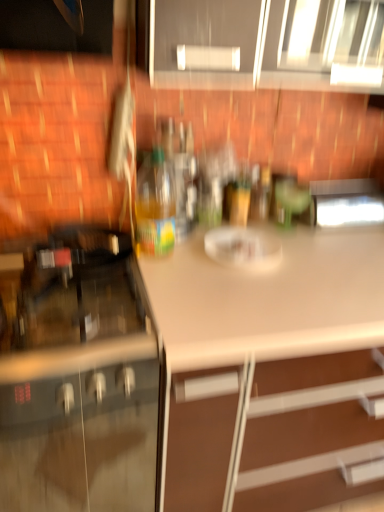
This screenshot has height=512, width=384. Describe the element at coordinates (76, 377) in the screenshot. I see `matte black oven at left, the second cabinetry when ordered from right to left` at that location.

Image resolution: width=384 pixels, height=512 pixels. Describe the element at coordinates (155, 205) in the screenshot. I see `translucent plastic bottle at center` at that location.

Where is `white matte countertop at center`? white matte countertop at center is located at coordinates (271, 372).

Which object is further away from the camera taking this photo, matte black oven at left, acting as the 1th cabinetry starting from the bottom, or matte gray cabinets at upper center, marked as the 2th cabinetry in a bottom-to-top arrangement?

matte gray cabinets at upper center, marked as the 2th cabinetry in a bottom-to-top arrangement, is behind.

Can you confirm if matte black oven at left, the first cabinetry in the left-to-right sequence, is smaller than matte gray cabinets at upper center, positioned as the first cabinetry in top-to-bottom order?

Incorrect, matte black oven at left, the first cabinetry in the left-to-right sequence, is not smaller in size than matte gray cabinets at upper center, positioned as the first cabinetry in top-to-bottom order.

Is matte black oven at left, the second cabinetry when ordered from top to bottom, in contact with matte gray cabinets at upper center, which appears as the 1th cabinetry when viewed from the right?

No, matte black oven at left, the second cabinetry when ordered from top to bottom, is not making contact with matte gray cabinets at upper center, which appears as the 1th cabinetry when viewed from the right.

Considering the relative positions of matte gray cabinets at upper center, marked as the 2th cabinetry in a bottom-to-top arrangement, and matte black oven at left, the second cabinetry when ordered from top to bottom, in the image provided, is matte gray cabinets at upper center, marked as the 2th cabinetry in a bottom-to-top arrangement, to the left of matte black oven at left, the second cabinetry when ordered from top to bottom, from the viewer's perspective?

No, matte gray cabinets at upper center, marked as the 2th cabinetry in a bottom-to-top arrangement, is not to the left of matte black oven at left, the second cabinetry when ordered from top to bottom.

Is matte gray cabinets at upper center, arranged as the second cabinetry when viewed from the left, not within matte black oven at left, the second cabinetry when ordered from right to left?

Indeed, matte gray cabinets at upper center, arranged as the second cabinetry when viewed from the left, is completely outside matte black oven at left, the second cabinetry when ordered from right to left.

Is matte gray cabinets at upper center, which appears as the 1th cabinetry when viewed from the right, positioned in front of matte black oven at left, the first cabinetry in the left-to-right sequence?

No, matte gray cabinets at upper center, which appears as the 1th cabinetry when viewed from the right, is further to the viewer.

Which of these two, matte gray cabinets at upper center, which appears as the 1th cabinetry when viewed from the right, or matte black oven at left, acting as the 1th cabinetry starting from the bottom, is bigger?

matte black oven at left, acting as the 1th cabinetry starting from the bottom, is bigger.

Would you say metallic stainless steel microwave at upper right is inside or outside matte gray cabinets at upper center, which appears as the 1th cabinetry when viewed from the right?

metallic stainless steel microwave at upper right is located beyond the bounds of matte gray cabinets at upper center, which appears as the 1th cabinetry when viewed from the right.

Which is nearer, (362, 185) or (177, 4)?

Point (362, 185) is farther from the camera than point (177, 4).

Which object is positioned more to the right, metallic stainless steel microwave at upper right or matte gray cabinets at upper center, arranged as the second cabinetry when viewed from the left?

metallic stainless steel microwave at upper right is more to the right.

Image resolution: width=384 pixels, height=512 pixels. Find the location of `appliance below the matte gray cabinets at upper center, which appears as the 1th cabinetry when viewed from the right (from the image's perspective)`. appliance below the matte gray cabinets at upper center, which appears as the 1th cabinetry when viewed from the right (from the image's perspective) is located at coordinates (347, 202).

Is matte gray cabinets at upper center, positioned as the first cabinetry in top-to-bottom order, oriented away from translucent plastic bottle at center?

→ No, translucent plastic bottle at center is not at the back of matte gray cabinets at upper center, positioned as the first cabinetry in top-to-bottom order.

Is point (235, 2) positioned after point (148, 206)?

No.

Which is more to the left, matte gray cabinets at upper center, arranged as the second cabinetry when viewed from the left, or translucent plastic bottle at center?

translucent plastic bottle at center.

How many degrees apart are the facing directions of matte gray cabinets at upper center, arranged as the second cabinetry when viewed from the left, and translucent plastic bottle at center?

1.31 degrees.

Who is bigger, metallic stainless steel microwave at upper right or translucent plastic bottle at center?

metallic stainless steel microwave at upper right is bigger.

Considering the positions of objects metallic stainless steel microwave at upper right and translucent plastic bottle at center in the image provided, who is in front, metallic stainless steel microwave at upper right or translucent plastic bottle at center?

Positioned in front is translucent plastic bottle at center.

Is metallic stainless steel microwave at upper right completely or partially outside of translucent plastic bottle at center?

That's correct, metallic stainless steel microwave at upper right is outside of translucent plastic bottle at center.

This screenshot has height=512, width=384. Find the location of `kitchen appliance located on the left of white matte countertop at center`. kitchen appliance located on the left of white matte countertop at center is located at coordinates (155, 205).

Does white matte countertop at center have a greater height compared to translucent plastic bottle at center?

Indeed, white matte countertop at center has a greater height compared to translucent plastic bottle at center.

Consider the image. From the image's perspective, between white matte countertop at center and translucent plastic bottle at center, who is located below?

white matte countertop at center, from the image's perspective.

Is white matte countertop at center thinner than translucent plastic bottle at center?

In fact, white matte countertop at center might be wider than translucent plastic bottle at center.

Starting from the metallic stainless steel microwave at upper right, which cabinetry is the 2nd one to the left? Please provide its 2D coordinates.

[(76, 377)]

Can you tell me how much matte black oven at left, the second cabinetry when ordered from top to bottom, and metallic stainless steel microwave at upper right differ in facing direction?

There is a 1.54-degree angle between the facing directions of matte black oven at left, the second cabinetry when ordered from top to bottom, and metallic stainless steel microwave at upper right.

Are matte black oven at left, acting as the 1th cabinetry starting from the bottom, and metallic stainless steel microwave at upper right located far from each other?

matte black oven at left, acting as the 1th cabinetry starting from the bottom, is near metallic stainless steel microwave at upper right, not far away.

Does matte black oven at left, the first cabinetry in the left-to-right sequence, have a lesser width compared to metallic stainless steel microwave at upper right?

No, matte black oven at left, the first cabinetry in the left-to-right sequence, is not thinner than metallic stainless steel microwave at upper right.

Identify the location of cabinetry behind the matte black oven at left, acting as the 1th cabinetry starting from the bottom. The image size is (384, 512). (264, 42).

Locate an element on the screen. The width and height of the screenshot is (384, 512). cabinetry lying below the matte gray cabinets at upper center, which appears as the 1th cabinetry when viewed from the right (from the image's perspective) is located at coordinates (76, 377).

Looking at the image, which one is located further to matte black oven at left, the second cabinetry when ordered from top to bottom, metallic stainless steel microwave at upper right or matte gray cabinets at upper center, arranged as the second cabinetry when viewed from the left?

metallic stainless steel microwave at upper right is positioned further to the anchor matte black oven at left, the second cabinetry when ordered from top to bottom.

Based on their spatial positions, is metallic stainless steel microwave at upper right or matte gray cabinets at upper center, which appears as the 1th cabinetry when viewed from the right, further from white matte countertop at center?

The object further to white matte countertop at center is matte gray cabinets at upper center, which appears as the 1th cabinetry when viewed from the right.

Estimate the real-world distances between objects in this image. Which object is closer to matte gray cabinets at upper center, which appears as the 1th cabinetry when viewed from the right, metallic stainless steel microwave at upper right or translucent plastic bottle at center?

The object closer to matte gray cabinets at upper center, which appears as the 1th cabinetry when viewed from the right, is translucent plastic bottle at center.

When comparing their distances from matte gray cabinets at upper center, arranged as the second cabinetry when viewed from the left, does matte black oven at left, the second cabinetry when ordered from top to bottom, or translucent plastic bottle at center seem closer?

Based on the image, translucent plastic bottle at center appears to be nearer to matte gray cabinets at upper center, arranged as the second cabinetry when viewed from the left.

Which object lies further to the anchor point matte black oven at left, the second cabinetry when ordered from right to left, matte gray cabinets at upper center, marked as the 2th cabinetry in a bottom-to-top arrangement, or translucent plastic bottle at center?

matte gray cabinets at upper center, marked as the 2th cabinetry in a bottom-to-top arrangement.

Considering their positions, is white matte countertop at center positioned closer to metallic stainless steel microwave at upper right than matte gray cabinets at upper center, marked as the 2th cabinetry in a bottom-to-top arrangement?

matte gray cabinets at upper center, marked as the 2th cabinetry in a bottom-to-top arrangement.

Considering their positions, is translucent plastic bottle at center positioned further to matte gray cabinets at upper center, which appears as the 1th cabinetry when viewed from the right, than matte black oven at left, acting as the 1th cabinetry starting from the bottom?

Based on the image, matte black oven at left, acting as the 1th cabinetry starting from the bottom, appears to be further to matte gray cabinets at upper center, which appears as the 1th cabinetry when viewed from the right.

Estimate the real-world distances between objects in this image. Which object is closer to white matte countertop at center, metallic stainless steel microwave at upper right or translucent plastic bottle at center?

The object closer to white matte countertop at center is translucent plastic bottle at center.

Locate an element on the screen. This screenshot has width=384, height=512. countertop situated between translucent plastic bottle at center and metallic stainless steel microwave at upper right from left to right is located at coordinates (271, 372).

Where is `countertop that lies between matte gray cabinets at upper center, arranged as the second cabinetry when viewed from the left, and matte black oven at left, the second cabinetry when ordered from top to bottom, from top to bottom`? countertop that lies between matte gray cabinets at upper center, arranged as the second cabinetry when viewed from the left, and matte black oven at left, the second cabinetry when ordered from top to bottom, from top to bottom is located at coordinates (271, 372).

Locate an element on the screen. Image resolution: width=384 pixels, height=512 pixels. kitchen appliance between matte gray cabinets at upper center, positioned as the first cabinetry in top-to-bottom order, and matte black oven at left, the second cabinetry when ordered from top to bottom, vertically is located at coordinates (155, 205).

Locate an element on the screen. This screenshot has height=512, width=384. kitchen appliance between matte gray cabinets at upper center, positioned as the first cabinetry in top-to-bottom order, and white matte countertop at center, in the vertical direction is located at coordinates (155, 205).